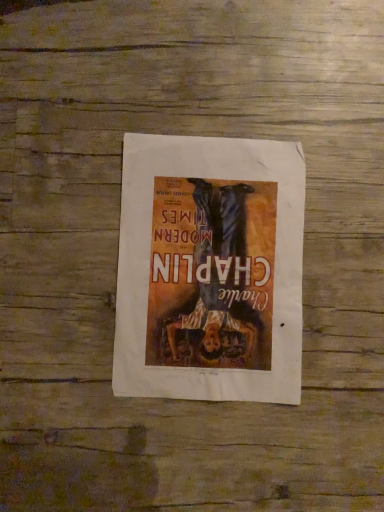
Find the location of `matte paper poster at center`. matte paper poster at center is located at coordinates (210, 269).

What do you see at coordinates (210, 269) in the screenshot? I see `matte paper poster at center` at bounding box center [210, 269].

This screenshot has width=384, height=512. I want to click on matte paper poster at center, so [x=210, y=269].